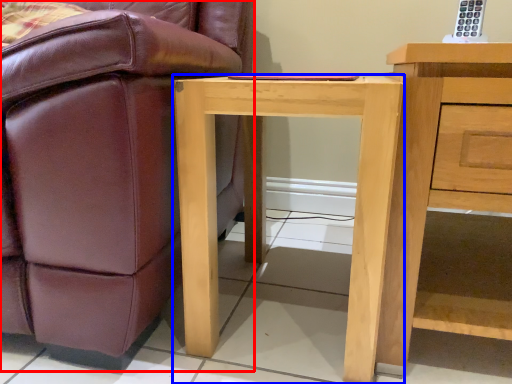
Question: Which of the following is the closest to the observer, chair (highlighted by a red box) or desk (highlighted by a blue box)?

Choices:
 (A) chair
 (B) desk

Answer: (A)